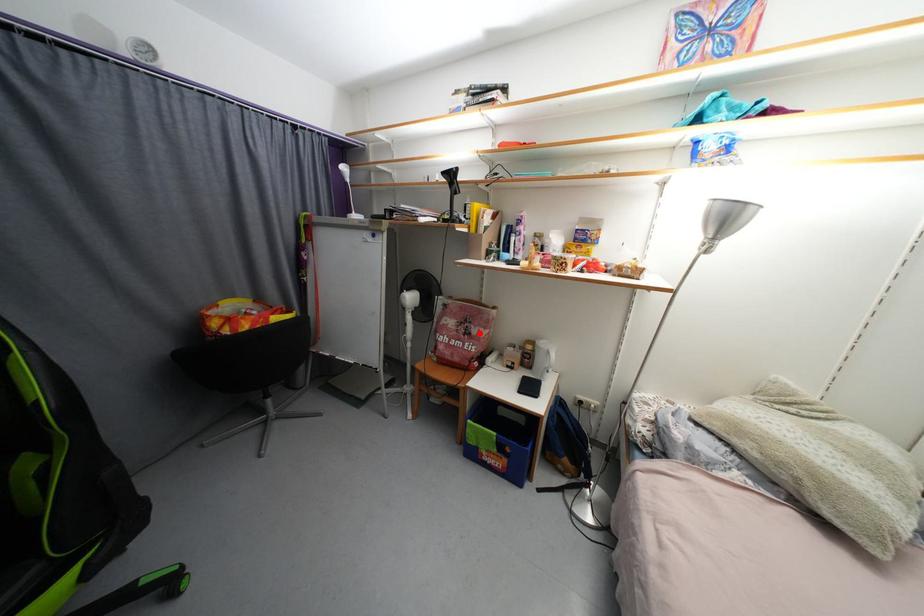
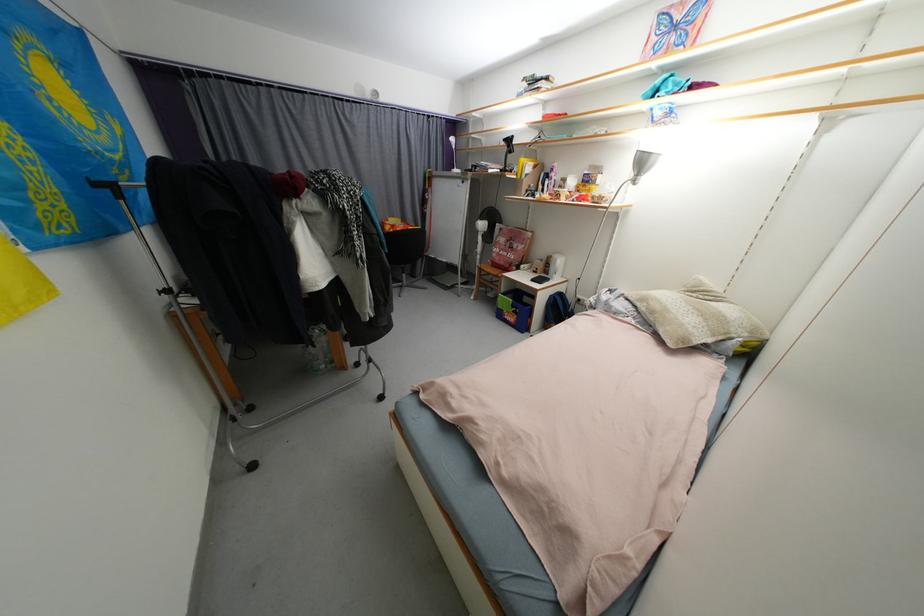
Question: I am providing you with two images of the same scene from different viewpoints. In image1, a red point is highlighted. Considering the same 3D point in image2, which of the following is correct?

Choices:
 (A) It is closer
 (B) It is farther

Answer: (A)